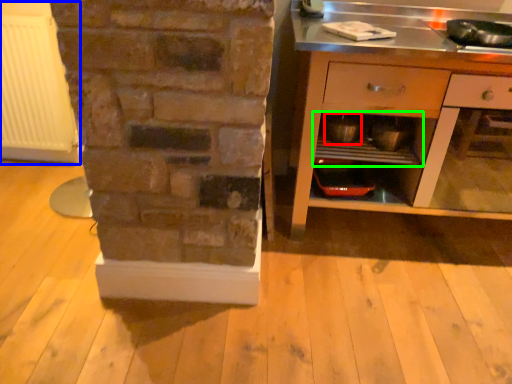
Question: Which is nearer to the appliance (highlighted by a red box)? radiator (highlighted by a blue box) or shelf (highlighted by a green box).

Choices:
 (A) radiator
 (B) shelf

Answer: (B)